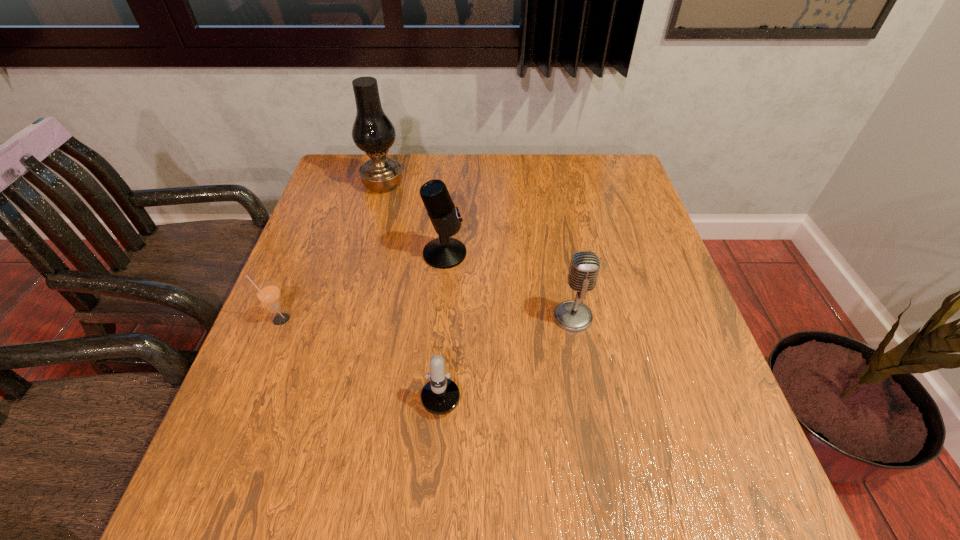
Find the location of a particular element. free point located 0.090m on the right of the second farthest microphone is located at coordinates (633, 317).

Find the location of a particular element. This screenshot has height=540, width=960. vacant region located on the front of the straw is located at coordinates (238, 423).

Where is `vacant space located 0.150m on the left of the nearest object`? vacant space located 0.150m on the left of the nearest object is located at coordinates (348, 377).

You are a GUI agent. You are given a task and a screenshot of the screen. Output one action in this format:
    pyautogui.click(x=<x>, y=<y>)
    Task: Click on the object present at the far edge
    This screenshot has width=960, height=540.
    Given the screenshot: What is the action you would take?
    pyautogui.click(x=373, y=132)

Image resolution: width=960 pixels, height=540 pixels. What are the coordinates of `oil lamp at the left edge` in the screenshot? It's located at (373, 132).

This screenshot has width=960, height=540. In order to click on straw located in the left edge section of the desktop in this screenshot , I will do `click(268, 293)`.

At what (x,y) coordinates should I click in order to perform the action: click on object at the far left corner. Please return your answer as a coordinate pair (x, y). The height and width of the screenshot is (540, 960). Looking at the image, I should click on (373, 132).

In the image, there is a desktop. Find the location of `vacant space at the far edge`. vacant space at the far edge is located at coordinates pyautogui.click(x=546, y=195).

At what (x,y) coordinates should I click in order to perform the action: click on free space at the near edge of the desktop. Please return your answer as a coordinate pair (x, y). Image resolution: width=960 pixels, height=540 pixels. Looking at the image, I should click on (653, 517).

I want to click on vacant space at the left edge of the desktop, so click(251, 456).